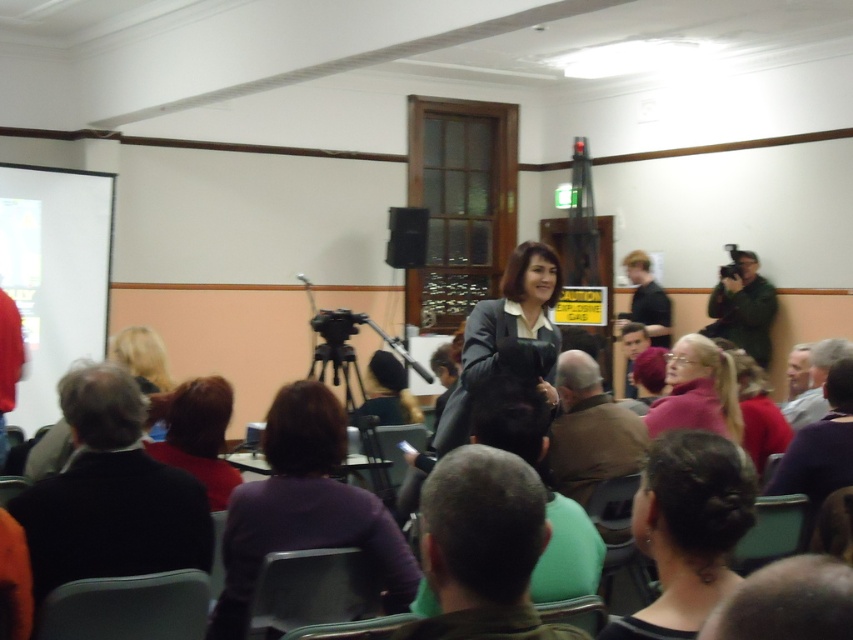
In the scene shown: Who is lower down, green fabric head at center or dark purple sweater at center?

dark purple sweater at center is below.

Consider the image. Can you confirm if green fabric head at center is positioned to the left of dark purple sweater at center?

Incorrect, green fabric head at center is not on the left side of dark purple sweater at center.

Is point (434, 545) in front of point (383, 369)?

Yes, point (434, 545) is in front of point (383, 369).

In order to click on green fabric head at center in this screenshot , I will do `click(483, 548)`.

Between purple fabric at center and black shirt at upper right, which one appears on the right side from the viewer's perspective?

black shirt at upper right

In the scene shown: Does purple fabric at center have a smaller size compared to black shirt at upper right?

Yes, purple fabric at center is smaller than black shirt at upper right.

Between point (357, 496) and point (664, 304), which one is positioned behind?

Positioned behind is point (664, 304).

This screenshot has height=640, width=853. What are the coordinates of `purple fabric at center` in the screenshot? It's located at (305, 508).

Which is more to the right, purple fabric at center or matte purple shirt at lower left?

purple fabric at center

Which of these two, purple fabric at center or matte purple shirt at lower left, stands shorter?

With less height is matte purple shirt at lower left.

Between point (247, 518) and point (210, 483), which one is positioned in front?

Point (247, 518)

Find the location of a particular element. The image size is (853, 640). purple fabric at center is located at coordinates (305, 508).